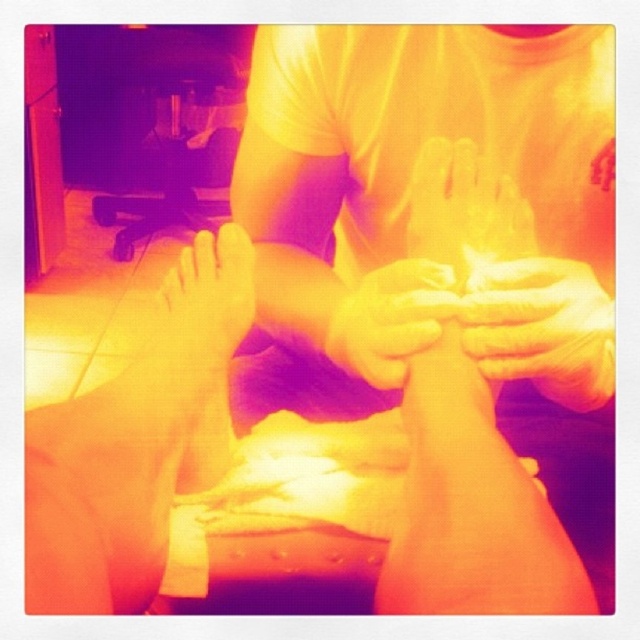
Between white rubber glove at center and smooth white hand at center, which one has more height?

Standing taller between the two is white rubber glove at center.

Can you confirm if white rubber glove at center is bigger than smooth white hand at center?

Actually, white rubber glove at center might be smaller than smooth white hand at center.

This screenshot has width=640, height=640. Describe the element at coordinates (544, 328) in the screenshot. I see `white rubber glove at center` at that location.

Find the location of a particular element. white rubber glove at center is located at coordinates (544, 328).

Can you confirm if white rubber glove at center is bigger than smooth white hands at center?

No.

Does white rubber glove at center have a greater height compared to smooth white hands at center?

Correct, white rubber glove at center is much taller as smooth white hands at center.

Describe the element at coordinates (544, 328) in the screenshot. I see `white rubber glove at center` at that location.

This screenshot has height=640, width=640. I want to click on white rubber glove at center, so click(544, 328).

Who is higher up, smooth white hand at center or smooth white hands at center?

smooth white hand at center is above.

Between smooth white hand at center and smooth white hands at center, which one is positioned lower?

Positioned lower is smooth white hands at center.

Who is more forward, (513,257) or (385,317)?

Point (385,317) is more forward.

Image resolution: width=640 pixels, height=640 pixels. I want to click on smooth white hand at center, so click(465, 209).